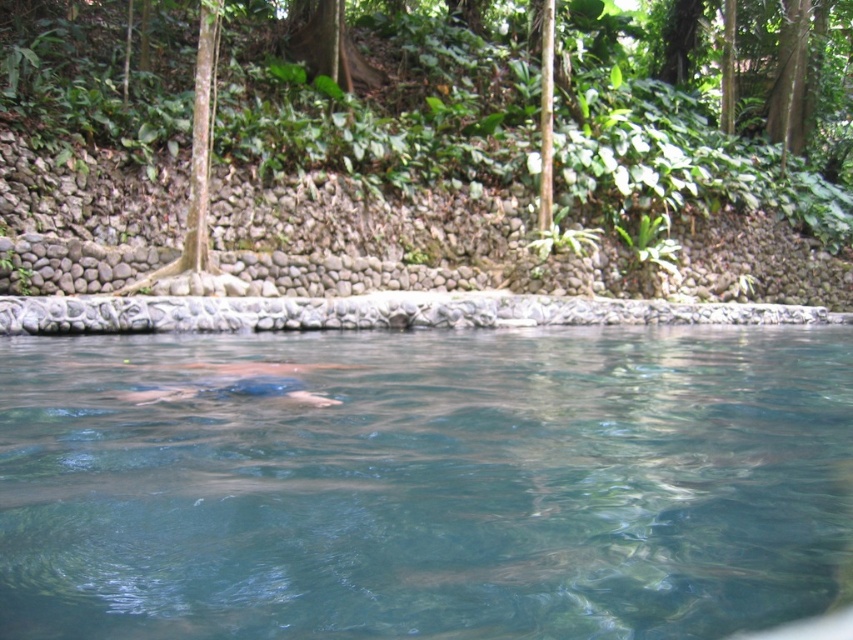
Identify the location of clear water at center. The image size is (853, 640). (432, 486).

Measure the distance between point (202, 620) and camera.

The distance of point (202, 620) from camera is 2.28 meters.

Who is more forward, [126,378] or [263,381]?

Point [263,381] is more forward.

Find the location of a particular element. The image size is (853, 640). clear water at center is located at coordinates (432, 486).